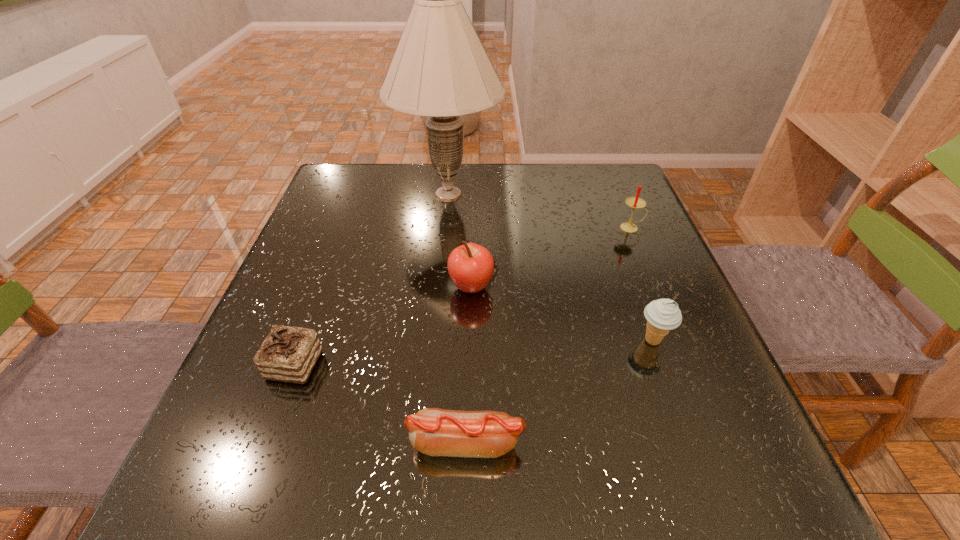
This screenshot has height=540, width=960. What are the coordinates of `blank space at the right edge of the desktop` in the screenshot? It's located at (665, 423).

Find the location of a particular element. free location at the far left corner of the desktop is located at coordinates (362, 189).

I want to click on blank space at the near left corner of the desktop, so click(x=201, y=515).

You are a GUI agent. You are given a task and a screenshot of the screen. Output one action in this format:
    pyautogui.click(x=<x>, y=<y>)
    Task: Click on the blank space at the far right corner of the desktop
    The image size is (960, 540).
    Given the screenshot: What is the action you would take?
    pyautogui.click(x=614, y=189)

At what (x,y) coordinates should I click in order to perform the action: click on free space at the near right corner of the desktop. Please return your answer as a coordinate pair (x, y). The height and width of the screenshot is (540, 960). Looking at the image, I should click on (714, 505).

You are a GUI agent. You are given a task and a screenshot of the screen. Output one action in this format:
    pyautogui.click(x=<x>, y=<y>)
    Task: Click on the vacant point located between the nearest object and the apple
    Image resolution: width=960 pixels, height=540 pixels.
    Given the screenshot: What is the action you would take?
    pyautogui.click(x=468, y=365)

Where is `vacant space that's between the icecream and the apple`? The width and height of the screenshot is (960, 540). vacant space that's between the icecream and the apple is located at coordinates [562, 314].

Locate an element on the screen. free space between the leftmost object and the icecream is located at coordinates (474, 353).

In order to click on free spot between the sausage and the leftmost object in this screenshot , I will do `click(380, 404)`.

This screenshot has height=540, width=960. Find the location of `empty location between the lampshade and the icecream`. empty location between the lampshade and the icecream is located at coordinates (551, 267).